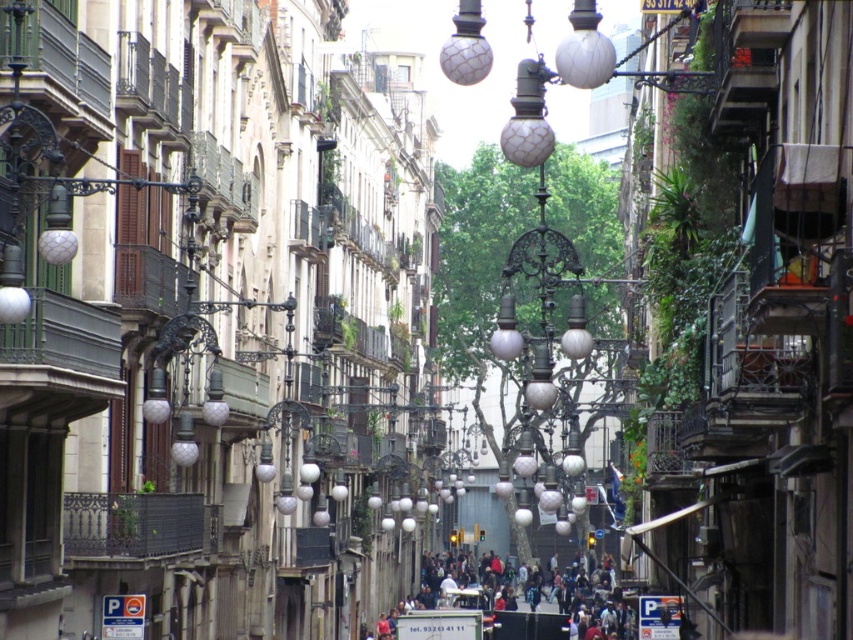
Question: From the image, what is the correct spatial relationship of matte glass lamp post at center in relation to dark gray concrete crowd at center?

Choices:
 (A) above
 (B) below

Answer: (A)

Question: Which of the following is the closest to the observer?

Choices:
 (A) matte glass lamp post at center
 (B) dark gray concrete crowd at center

Answer: (A)

Question: Does matte glass lamp post at center appear on the right side of dark gray concrete crowd at center?

Choices:
 (A) no
 (B) yes

Answer: (B)

Question: Which of the following is the farthest from the observer?

Choices:
 (A) matte glass lamp post at center
 (B) dark gray concrete crowd at center

Answer: (B)

Question: In this image, where is matte glass lamp post at center located relative to dark gray concrete crowd at center?

Choices:
 (A) below
 (B) above

Answer: (B)